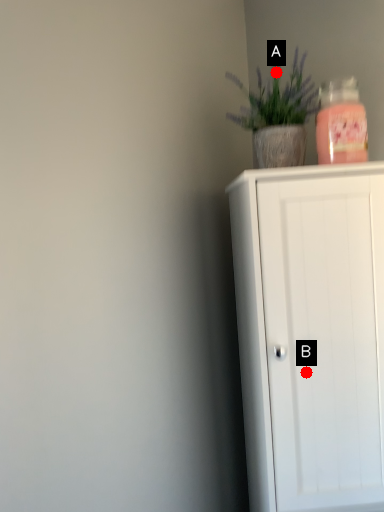
Question: Two points are circled on the image, labeled by A and B beside each circle. Which point is closer to the camera taking this photo?

Choices:
 (A) A is closer
 (B) B is closer

Answer: (B)